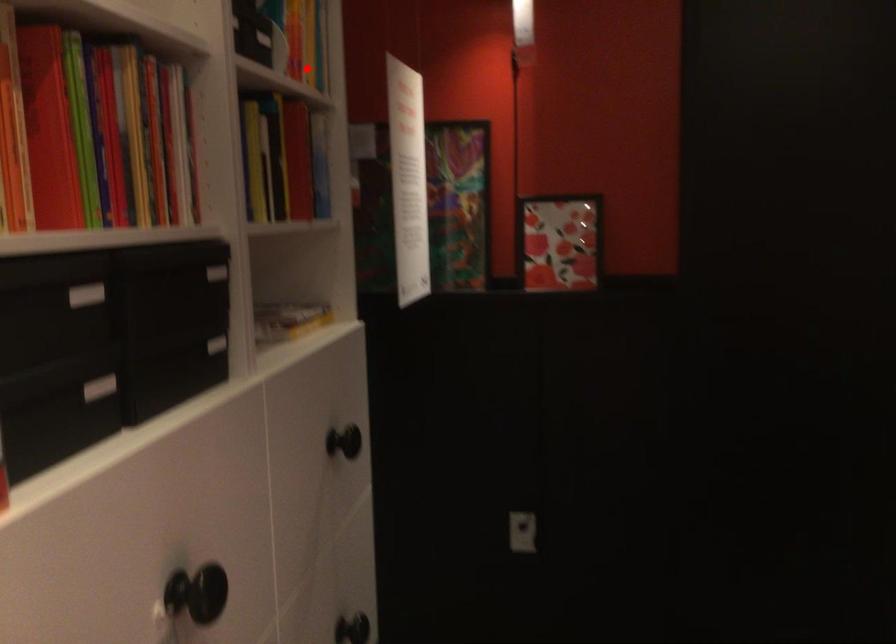
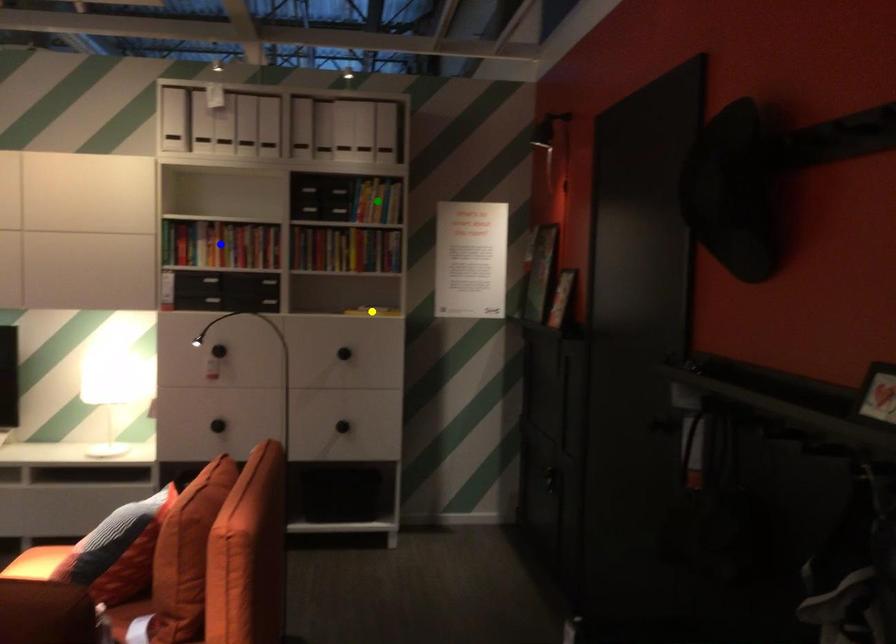
Question: I am providing you with two images of the same scene from different viewpoints. A red point is marked on the first image. You are given multiple points on the second image. In image 2, which mark is for the same physical point as the one in image 1?

Choices:
 (A) green point
 (B) yellow point
 (C) blue point

Answer: (A)